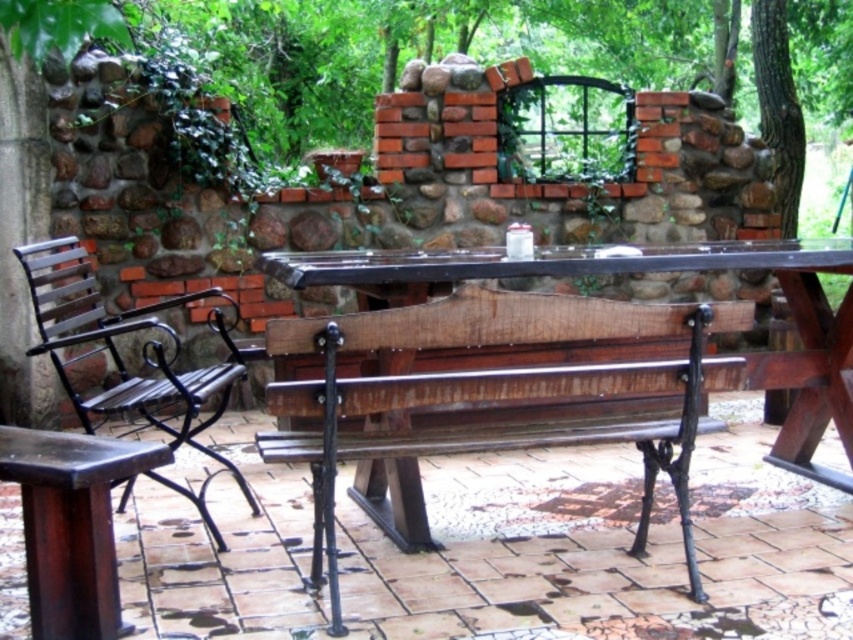
Who is taller, black wrought iron chair at left or dark brown wood stool at lower left?

black wrought iron chair at left is taller.

From the picture: Between black wrought iron chair at left and dark brown wood stool at lower left, which one is positioned higher?

black wrought iron chair at left

Describe the element at coordinates (119, 353) in the screenshot. I see `black wrought iron chair at left` at that location.

Locate an element on the screen. The image size is (853, 640). black wrought iron chair at left is located at coordinates (119, 353).

Does rustic wood bench at center have a smaller size compared to black wrought iron chair at left?

Incorrect, rustic wood bench at center is not smaller in size than black wrought iron chair at left.

Can you confirm if rustic wood bench at center is positioned below black wrought iron chair at left?

Correct, rustic wood bench at center is located below black wrought iron chair at left.

Is point (639, 316) behind point (57, 365)?

No, (639, 316) is in front of (57, 365).

This screenshot has width=853, height=640. Find the location of `rustic wood bench at center`. rustic wood bench at center is located at coordinates (498, 394).

Who is lower down, rustic wood bench at center or dark brown wood stool at lower left?

dark brown wood stool at lower left is lower down.

Does point (579, 323) come in front of point (45, 472)?

No, it is not.

You are a GUI agent. You are given a task and a screenshot of the screen. Output one action in this format:
    pyautogui.click(x=<x>, y=<y>)
    Task: Click on the rustic wood bench at center
    
    Given the screenshot: What is the action you would take?
    pyautogui.click(x=498, y=394)